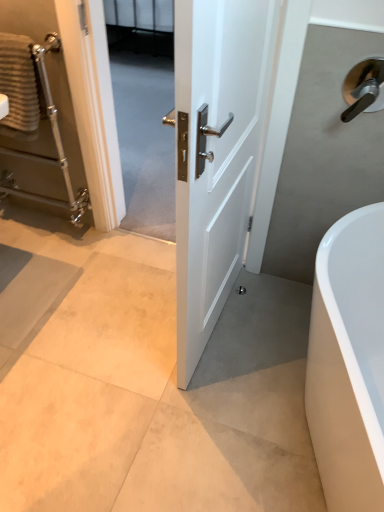
Question: Can you confirm if polished chrome towel rack at left is positioned to the right of white glossy door at center?

Choices:
 (A) yes
 (B) no

Answer: (B)

Question: Is the surface of polished chrome towel rack at left in direct contact with white glossy door at center?

Choices:
 (A) yes
 (B) no

Answer: (B)

Question: Is polished chrome towel rack at left oriented away from white glossy door at center?

Choices:
 (A) yes
 (B) no

Answer: (B)

Question: From a real-world perspective, is polished chrome towel rack at left physically below white glossy door at center?

Choices:
 (A) no
 (B) yes

Answer: (B)

Question: Can you confirm if polished chrome towel rack at left is bigger than white glossy door at center?

Choices:
 (A) yes
 (B) no

Answer: (B)

Question: Does polished chrome towel rack at left contain white glossy door at center?

Choices:
 (A) yes
 (B) no

Answer: (B)

Question: Considering the relative positions of white glossy door at center and white glossy bathtub at lower right in the image provided, is white glossy door at center in front of white glossy bathtub at lower right?

Choices:
 (A) yes
 (B) no

Answer: (A)

Question: Would you say white glossy door at center is a long distance from white glossy bathtub at lower right?

Choices:
 (A) no
 (B) yes

Answer: (A)

Question: Is white glossy door at center next to white glossy bathtub at lower right?

Choices:
 (A) no
 (B) yes

Answer: (A)

Question: Is white glossy door at center facing away from white glossy bathtub at lower right?

Choices:
 (A) no
 (B) yes

Answer: (B)

Question: Can you confirm if white glossy door at center is bigger than white glossy bathtub at lower right?

Choices:
 (A) no
 (B) yes

Answer: (A)

Question: Is white glossy door at center thinner than white glossy bathtub at lower right?

Choices:
 (A) no
 (B) yes

Answer: (B)

Question: Is textured beige towel at left to the right of white glossy door at center from the viewer's perspective?

Choices:
 (A) no
 (B) yes

Answer: (A)